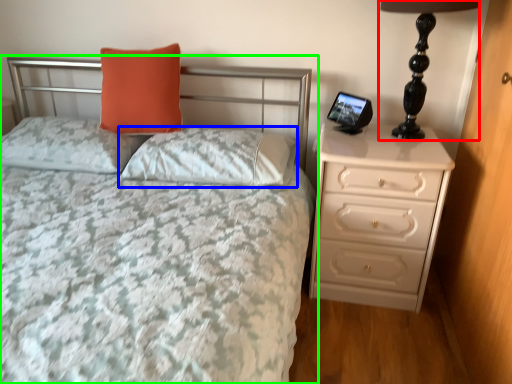
Question: Which object is positioned closest to table lamp (highlighted by a red box)? Select from pillow (highlighted by a blue box) and bed (highlighted by a green box).

Choices:
 (A) pillow
 (B) bed

Answer: (B)